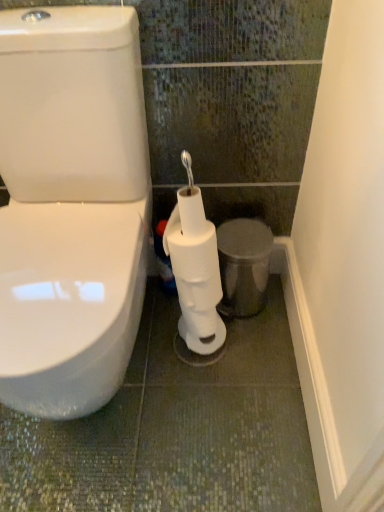
Question: Is point (172, 218) positioned closer to the camera than point (259, 237)?

Choices:
 (A) farther
 (B) closer

Answer: (B)

Question: Is white matte toilet paper at center, which is the 1th toilet paper from bottom to top, inside the boundaries of metallic silver trash can at lower right, or outside?

Choices:
 (A) inside
 (B) outside

Answer: (B)

Question: Which object is positioned farthest from the white matte toilet paper at center, which is counted as the second toilet paper, starting from the bottom?

Choices:
 (A) metallic silver trash can at lower right
 (B) white matte toilet paper at center, the 2th toilet paper when ordered from top to bottom

Answer: (A)

Question: Considering the real-world distances, which object is closest to the white matte toilet paper at center, which is the 1th toilet paper from bottom to top?

Choices:
 (A) white matte toilet paper at center, which ranks as the first toilet paper in top-to-bottom order
 (B) metallic silver trash can at lower right

Answer: (A)